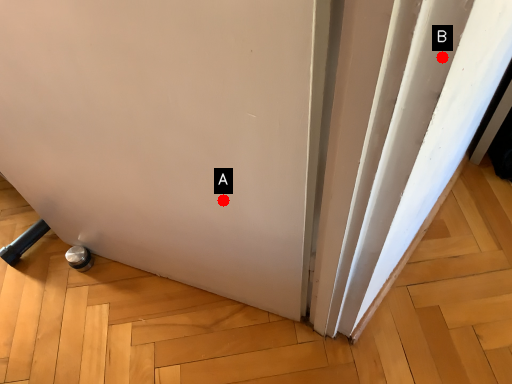
Question: Two points are circled on the image, labeled by A and B beside each circle. Which point is farther from the camera taking this photo?

Choices:
 (A) A is further
 (B) B is further

Answer: (A)